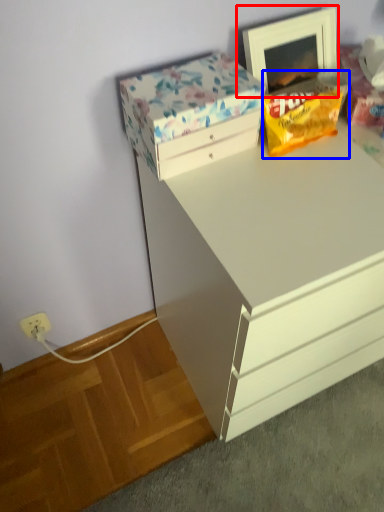
Question: Which object appears closest to the camera in this image, picture frame (highlighted by a red box) or snack (highlighted by a blue box)?

Choices:
 (A) picture frame
 (B) snack

Answer: (B)